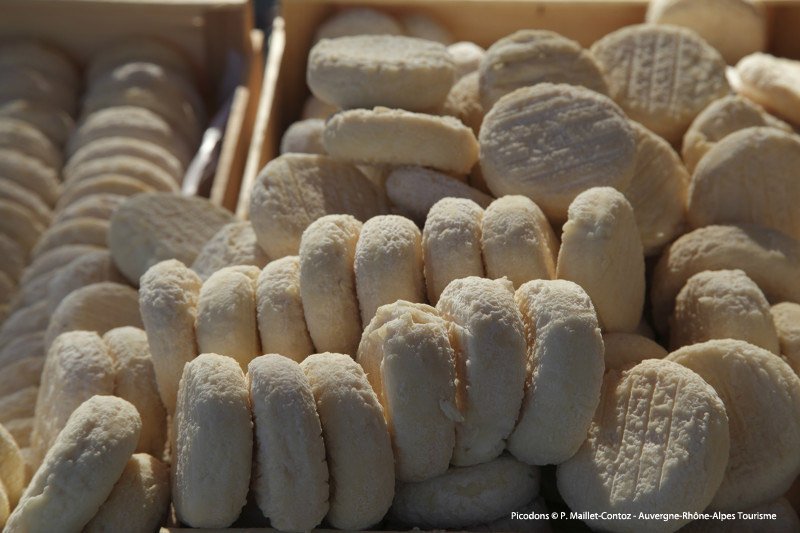
At what (x,y) coordinates should I click in order to perform the action: click on boxes. Please return your answer as a coordinate pair (x, y). The image size is (800, 533). Looking at the image, I should click on coord(270,102), coord(186,28).